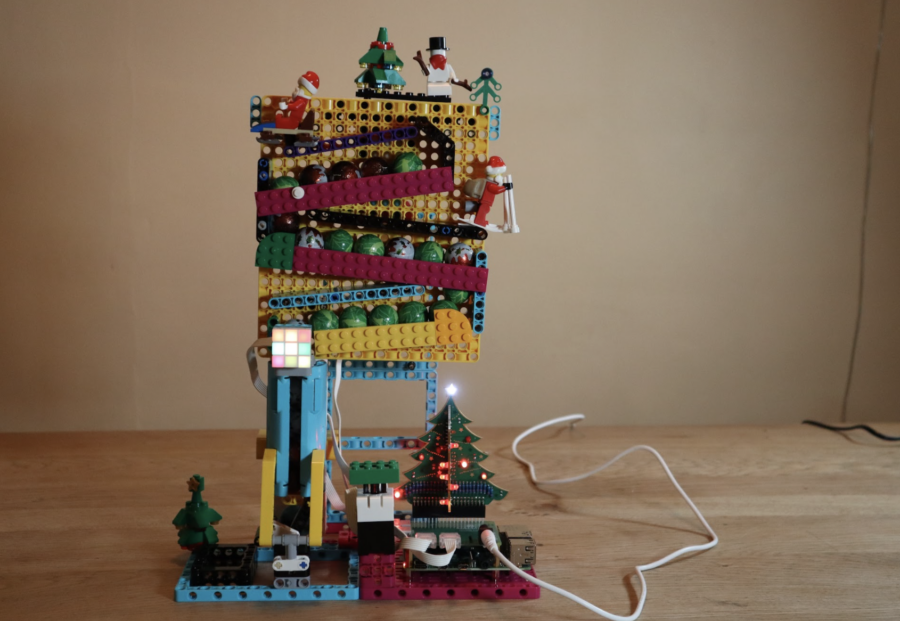
I want to click on lighted rubik's cube, so click(299, 348).